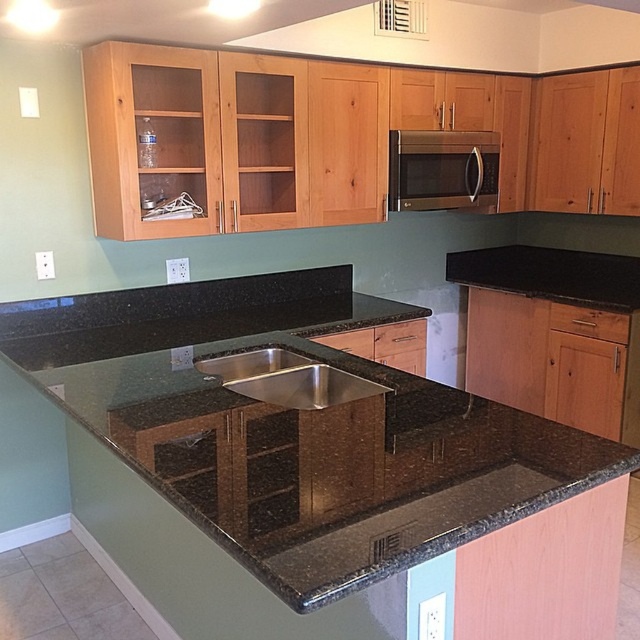
Question: Does satin stainless steel microwave at upper center appear under stainless steel sink at center?

Choices:
 (A) no
 (B) yes

Answer: (A)

Question: Which point is farther to the camera?

Choices:
 (A) stainless steel sink at center
 (B) satin stainless steel microwave at upper center

Answer: (B)

Question: Can you confirm if black granite countertop at center is positioned to the right of satin stainless steel microwave at upper center?

Choices:
 (A) no
 (B) yes

Answer: (A)

Question: In this image, where is black granite countertop at center located relative to satin stainless steel microwave at upper center?

Choices:
 (A) right
 (B) left

Answer: (B)

Question: Estimate the real-world distances between objects in this image. Which object is closer to the satin stainless steel microwave at upper center?

Choices:
 (A) black granite countertop at center
 (B) stainless steel sink at center

Answer: (A)

Question: Which of the following is the farthest from the observer?

Choices:
 (A) pos(406,381)
 (B) pos(417,138)

Answer: (B)